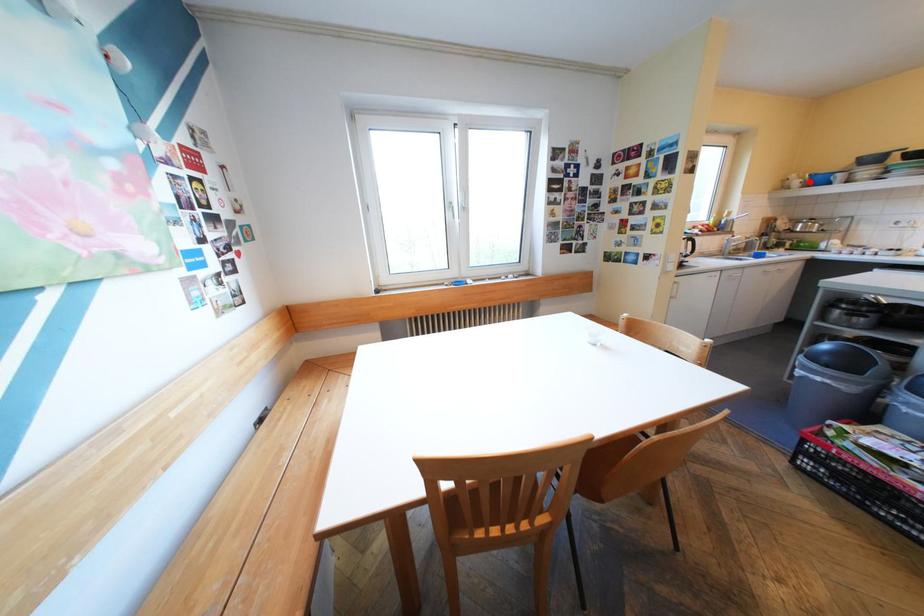
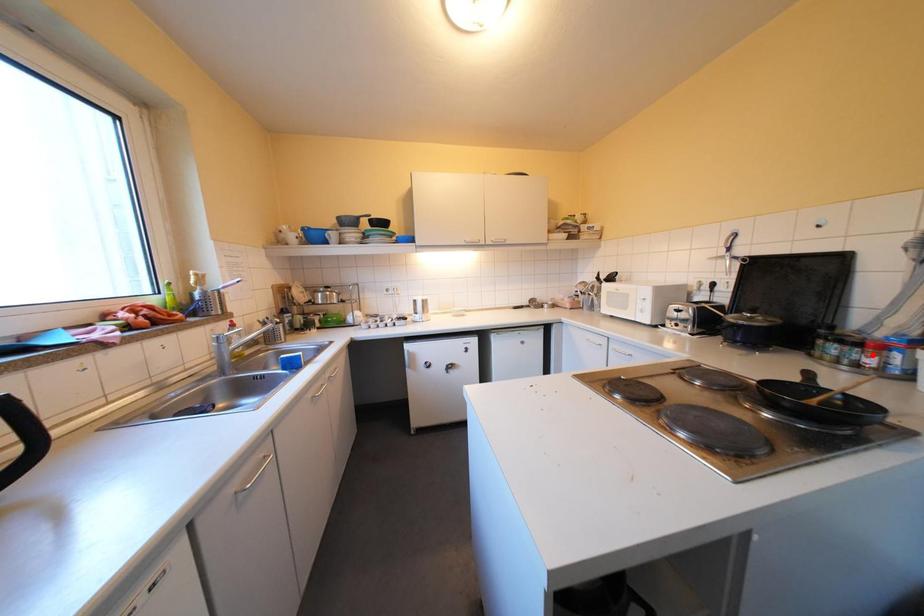
In the scene shown: I am providing you with two images of the same scene from different viewpoints. A red point is marked on the first image and another point is marked on the second image. Is the red point in image1 aligned with the point shown in image2?

No